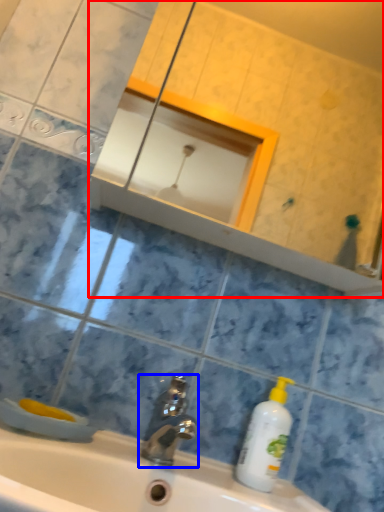
Question: Which point is further to the camera, mirror (highlighted by a red box) or tap (highlighted by a blue box)?

Choices:
 (A) mirror
 (B) tap

Answer: (A)